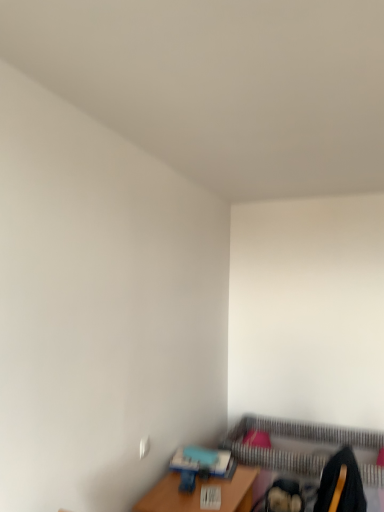
Question: Should I look upward or downward to see wooden table at lower right?

Choices:
 (A) up
 (B) down

Answer: (B)

Question: Is metallic gold swivel chair at lower right smaller than striped fabric bed frame at lower right?

Choices:
 (A) no
 (B) yes

Answer: (B)

Question: From the image's perspective, is metallic gold swivel chair at lower right over striped fabric bed frame at lower right?

Choices:
 (A) yes
 (B) no

Answer: (A)

Question: From a real-world perspective, is metallic gold swivel chair at lower right physically above striped fabric bed frame at lower right?

Choices:
 (A) no
 (B) yes

Answer: (B)

Question: Does metallic gold swivel chair at lower right come behind striped fabric bed frame at lower right?

Choices:
 (A) yes
 (B) no

Answer: (B)

Question: Considering the relative sizes of metallic gold swivel chair at lower right and striped fabric bed frame at lower right in the image provided, is metallic gold swivel chair at lower right taller than striped fabric bed frame at lower right?

Choices:
 (A) no
 (B) yes

Answer: (A)

Question: Is metallic gold swivel chair at lower right outside of striped fabric bed frame at lower right?

Choices:
 (A) no
 (B) yes

Answer: (B)

Question: Is the position of metallic gold swivel chair at lower right less distant than that of wooden table at lower right?

Choices:
 (A) yes
 (B) no

Answer: (A)

Question: From the image's perspective, is metallic gold swivel chair at lower right located above wooden table at lower right?

Choices:
 (A) yes
 (B) no

Answer: (A)

Question: From a real-world perspective, does metallic gold swivel chair at lower right sit lower than wooden table at lower right?

Choices:
 (A) no
 (B) yes

Answer: (A)

Question: Is metallic gold swivel chair at lower right thinner than wooden table at lower right?

Choices:
 (A) no
 (B) yes

Answer: (B)

Question: Is metallic gold swivel chair at lower right at the right side of wooden table at lower right?

Choices:
 (A) no
 (B) yes

Answer: (B)

Question: Is wooden table at lower right at the back of metallic gold swivel chair at lower right?

Choices:
 (A) no
 (B) yes

Answer: (A)

Question: Is wooden table at lower right to the left of striped fabric bed frame at lower right from the viewer's perspective?

Choices:
 (A) no
 (B) yes

Answer: (B)